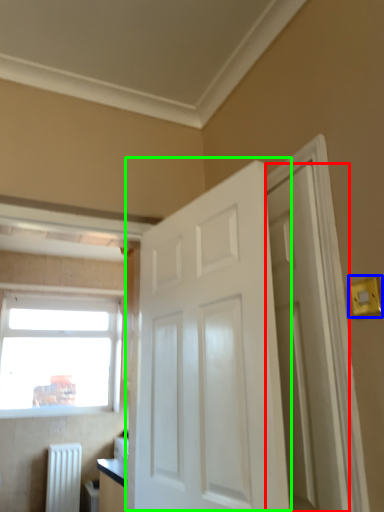
Question: Which object is the closest to the door (highlighted by a red box)? Choose among these: light switch (highlighted by a blue box) or door (highlighted by a green box).

Choices:
 (A) light switch
 (B) door

Answer: (B)